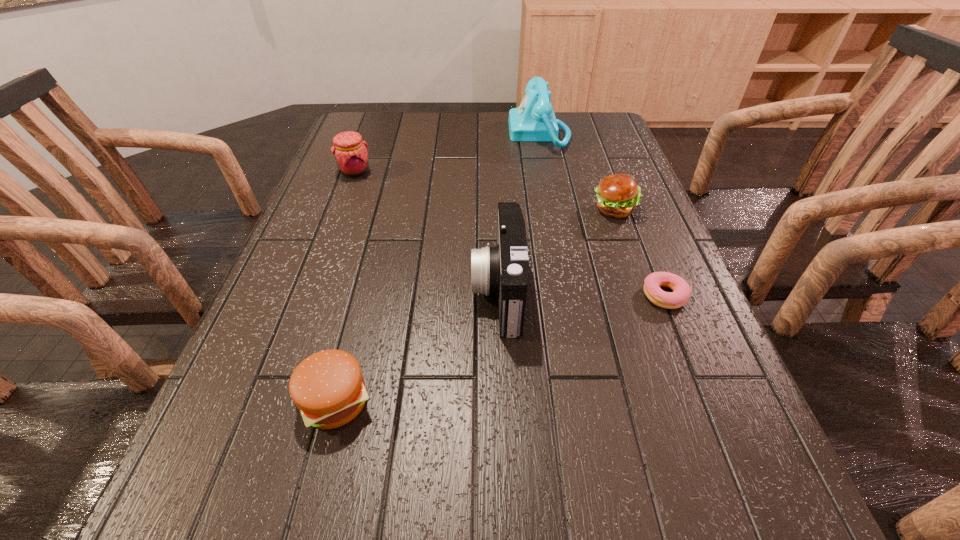
The width and height of the screenshot is (960, 540). In order to click on the fourth closest object relative to the third object from left to right in this screenshot , I will do `click(350, 151)`.

At what (x,y) coordinates should I click in order to perform the action: click on object that ranks as the second closest to the camcorder. Please return your answer as a coordinate pair (x, y). This screenshot has height=540, width=960. Looking at the image, I should click on (617, 195).

The height and width of the screenshot is (540, 960). I want to click on vacant point that satisfies the following two spatial constraints: 1. on the dial of the shortest object; 2. on the left side of the fourth object from left to right, so click(572, 295).

At what (x,y) coordinates should I click in order to perform the action: click on vacant space that satisfies the following two spatial constraints: 1. on the front side of the fifth nearest object; 2. on the right side of the nearest object. Please return your answer as a coordinate pair (x, y). Looking at the image, I should click on (269, 401).

You are a GUI agent. You are given a task and a screenshot of the screen. Output one action in this format:
    pyautogui.click(x=<x>, y=<y>)
    Task: Click on the free space that satisfies the following two spatial constraints: 1. on the lens of the fourth object from right to left; 2. on the front side of the nearer hamburger
    This screenshot has height=540, width=960.
    Given the screenshot: What is the action you would take?
    pyautogui.click(x=502, y=401)

Identify the location of vacant point that satisfies the following two spatial constraints: 1. on the front side of the farther hamburger; 2. on the lens of the camcorder. (644, 292).